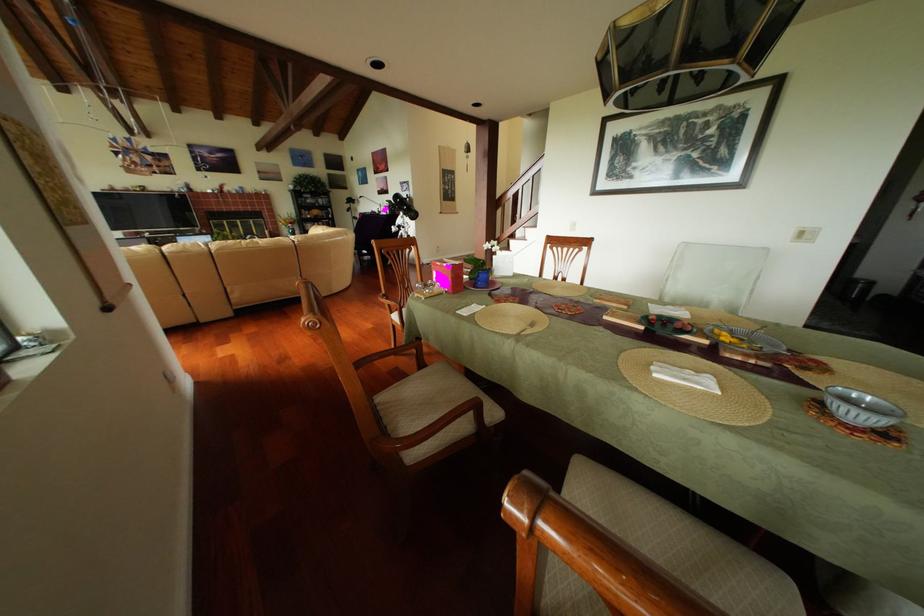
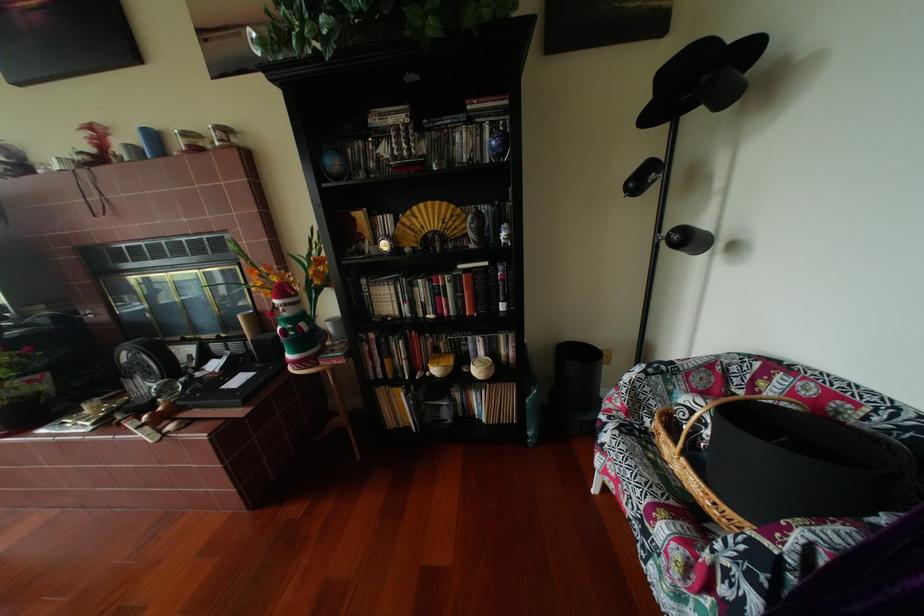
In the second image, find the point that corresponds to point 317,224 in the first image.

(377, 283)